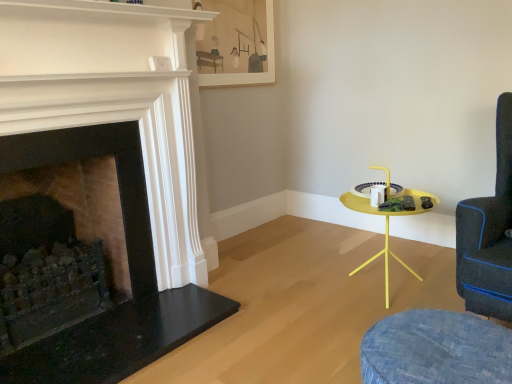
Question: Is matte black fireplace at left, which is the 2th fireplace from left to right, taller than matte wooden picture frame at upper center?

Choices:
 (A) yes
 (B) no

Answer: (A)

Question: From a real-world perspective, is matte black fireplace at left, which is the 2th fireplace from left to right, physically above matte wooden picture frame at upper center?

Choices:
 (A) no
 (B) yes

Answer: (A)

Question: Is matte black fireplace at left, marked as the first fireplace in a right-to-left arrangement, turned away from matte wooden picture frame at upper center?

Choices:
 (A) no
 (B) yes

Answer: (A)

Question: Is matte black fireplace at left, which is the 2th fireplace from left to right, not near matte wooden picture frame at upper center?

Choices:
 (A) no
 (B) yes

Answer: (B)

Question: Would you say matte black fireplace at left, which is the 2th fireplace from left to right, contains matte wooden picture frame at upper center?

Choices:
 (A) yes
 (B) no

Answer: (B)

Question: Visually, is dark stone fireplace at left, acting as the second fireplace starting from the right, positioned to the left or to the right of matte wooden picture frame at upper center?

Choices:
 (A) left
 (B) right

Answer: (A)

Question: Is dark stone fireplace at left, marked as the first fireplace in a left-to-right arrangement, bigger or smaller than matte wooden picture frame at upper center?

Choices:
 (A) big
 (B) small

Answer: (A)

Question: From a real-world perspective, is dark stone fireplace at left, acting as the second fireplace starting from the right, physically located above or below matte wooden picture frame at upper center?

Choices:
 (A) above
 (B) below

Answer: (B)

Question: From the image's perspective, is dark stone fireplace at left, acting as the second fireplace starting from the right, positioned above or below matte wooden picture frame at upper center?

Choices:
 (A) above
 (B) below

Answer: (B)

Question: Is point (138, 281) closer or farther from the camera than point (429, 195)?

Choices:
 (A) closer
 (B) farther

Answer: (A)

Question: From a real-world perspective, relative to yellow matte side table at right, is dark stone fireplace at left, marked as the first fireplace in a left-to-right arrangement, vertically above or below?

Choices:
 (A) below
 (B) above

Answer: (B)

Question: Would you say dark stone fireplace at left, acting as the second fireplace starting from the right, is inside or outside yellow matte side table at right?

Choices:
 (A) outside
 (B) inside

Answer: (A)

Question: Looking at the image, does dark stone fireplace at left, marked as the first fireplace in a left-to-right arrangement, seem bigger or smaller compared to yellow matte side table at right?

Choices:
 (A) big
 (B) small

Answer: (A)

Question: From a real-world perspective, is denim swivel chair at lower right, the 1th swivel chair when ordered from left to right, above or below dark blue fabric swivel chair at right, the first swivel chair in the right-to-left sequence?

Choices:
 (A) below
 (B) above

Answer: (A)

Question: From the image's perspective, is denim swivel chair at lower right, acting as the second swivel chair starting from the right, positioned above or below dark blue fabric swivel chair at right, the first swivel chair in the right-to-left sequence?

Choices:
 (A) above
 (B) below

Answer: (B)